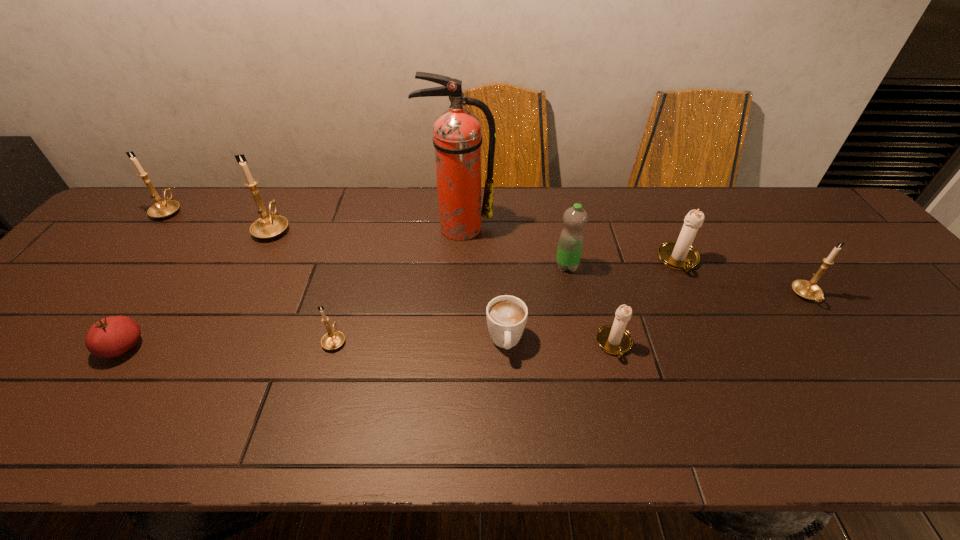
Locate which candle holder ranks third in proximity to the third smallest gold candle holder. Please provide its 2D coordinates. Your answer should be formatted as a tuple, i.e. [(x, y)], where the tuple contains the x and y coordinates of a point satisfying the conditions above.

[(614, 339)]

Image resolution: width=960 pixels, height=540 pixels. What are the coordinates of `candle holder object that ranks as the fifth closest to the fire extinguisher` in the screenshot? It's located at (162, 209).

You are a GUI agent. You are given a task and a screenshot of the screen. Output one action in this format:
    pyautogui.click(x=<x>, y=<y>)
    Task: Click on the third closest gold candle holder to the seventh object from left to right
    
    Given the screenshot: What is the action you would take?
    pyautogui.click(x=268, y=226)

Locate which gold candle holder ranks third in proximity to the red tomato. Please provide its 2D coordinates. Your answer should be formatted as a tuple, i.e. [(x, y)], where the tuple contains the x and y coordinates of a point satisfying the conditions above.

[(162, 209)]

This screenshot has width=960, height=540. Identify the location of vacant space that satisfies the following two spatial constraints: 1. on the handle side of the nearest gold candle holder; 2. on the left side of the water bottle. (356, 266).